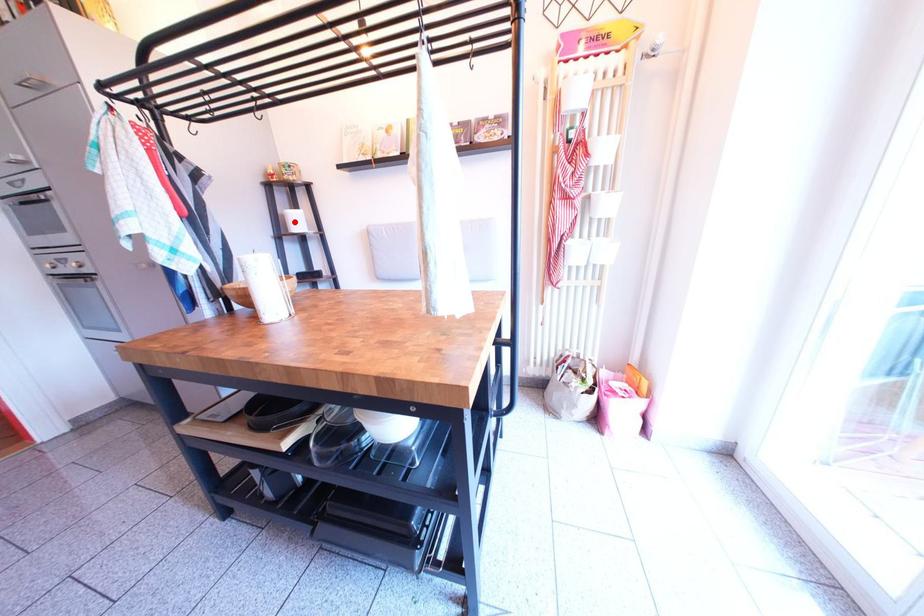
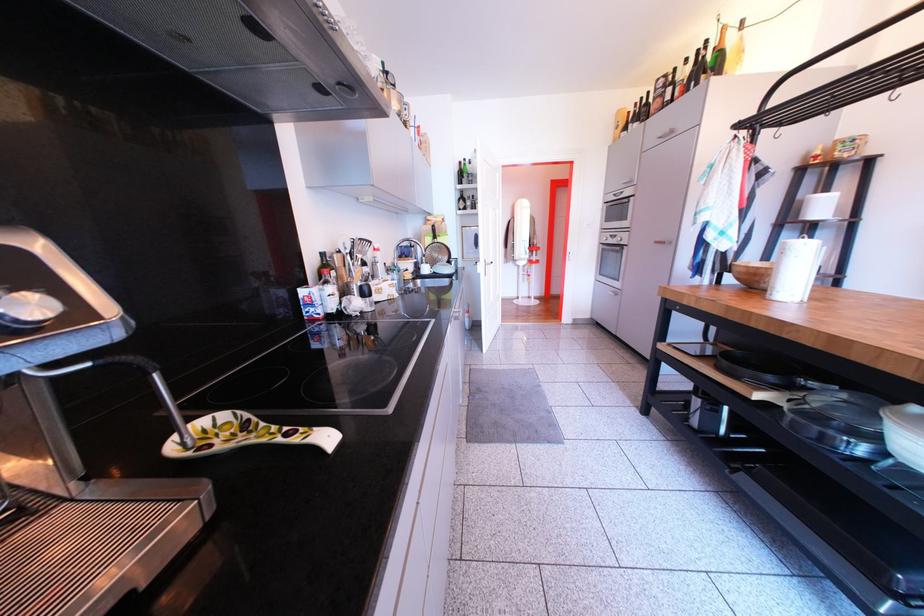
The point at the highlighted location is marked in the first image. Where is the corresponding point in the second image?

(813, 208)